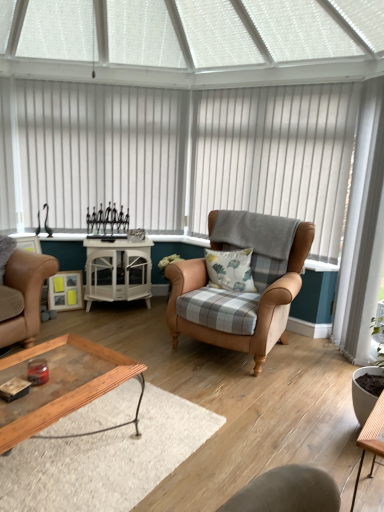
Image resolution: width=384 pixels, height=512 pixels. Describe the element at coordinates (276, 156) in the screenshot. I see `white vertical blinds at center, placed as the 1th blind when sorted from right to left` at that location.

From the picture: Measure the distance between point [379,398] and camera.

Point [379,398] and camera are 1.77 meters apart from each other.

How much space does white vertical blinds at upper center, the first blind when ordered from left to right, occupy horizontally?

It is 1.50 inches.

The height and width of the screenshot is (512, 384). What are the coordinates of `white vertical blinds at center, placed as the 1th blind when sorted from right to left` in the screenshot? It's located at (276, 156).

Is there a large distance between white vertical blinds at center, placed as the 1th blind when sorted from right to left, and leather armchair at center?

No, there isn't a large distance between white vertical blinds at center, placed as the 1th blind when sorted from right to left, and leather armchair at center.

In the scene shown: Is white vertical blinds at center, positioned as the 2th blind in left-to-right order, bigger or smaller than leather armchair at center?

In the image, white vertical blinds at center, positioned as the 2th blind in left-to-right order, appears to be smaller than leather armchair at center.

Does white vertical blinds at center, placed as the 1th blind when sorted from right to left, have a greater width compared to leather armchair at center?

In fact, white vertical blinds at center, placed as the 1th blind when sorted from right to left, might be narrower than leather armchair at center.

In the scene shown: Does white vertical blinds at center, positioned as the 2th blind in left-to-right order, contain leather armchair at center?

No, white vertical blinds at center, positioned as the 2th blind in left-to-right order, does not contain leather armchair at center.

Does wooden table at lower right, placed as the 2th table when sorted from back to front, touch wooden tray at lower center?

No.

Choose the correct answer: Is wooden table at lower right, the 1th table when ordered from right to left, inside wooden tray at lower center or outside it?

wooden table at lower right, the 1th table when ordered from right to left, exists outside the volume of wooden tray at lower center.

From the image's perspective, relative to wooden tray at lower center, is wooden table at lower right, which appears as the first table when ordered from the bottom, above or below?

Clearly, from the image's perspective, wooden table at lower right, which appears as the first table when ordered from the bottom, is below wooden tray at lower center.

Considering the positions of objects wooden table at lower right, the 1th table when ordered from right to left, and wooden tray at lower center in the image provided, who is more to the right, wooden table at lower right, the 1th table when ordered from right to left, or wooden tray at lower center?

wooden table at lower right, the 1th table when ordered from right to left.

Is white vertical blinds at upper center, the first blind when ordered from left to right, with wooden table at lower right, the second table in the top-to-bottom sequence?

white vertical blinds at upper center, the first blind when ordered from left to right, and wooden table at lower right, the second table in the top-to-bottom sequence, are not in contact.

Measure the distance between white vertical blinds at upper center, the first blind when ordered from left to right, and wooden table at lower right, the second table in the top-to-bottom sequence.

white vertical blinds at upper center, the first blind when ordered from left to right, is 10.50 feet from wooden table at lower right, the second table in the top-to-bottom sequence.

This screenshot has height=512, width=384. I want to click on the 2nd blind behind the wooden table at lower right, placed as the 2th table when sorted from back to front, so click(x=102, y=152).

Considering the sizes of white vertical blinds at upper center, marked as the 2th blind in a right-to-left arrangement, and wooden table at lower right, which appears as the first table when ordered from the bottom, in the image, is white vertical blinds at upper center, marked as the 2th blind in a right-to-left arrangement, bigger or smaller than wooden table at lower right, which appears as the first table when ordered from the bottom,?

Clearly, white vertical blinds at upper center, marked as the 2th blind in a right-to-left arrangement, is larger in size than wooden table at lower right, which appears as the first table when ordered from the bottom.

Is white vertical blinds at center, placed as the 1th blind when sorted from right to left, situated inside white vertical blinds at upper center, the first blind when ordered from left to right, or outside?

The correct answer is: outside.

Considering the sizes of white vertical blinds at center, positioned as the 2th blind in left-to-right order, and white vertical blinds at upper center, marked as the 2th blind in a right-to-left arrangement, in the image, is white vertical blinds at center, positioned as the 2th blind in left-to-right order, wider or thinner than white vertical blinds at upper center, marked as the 2th blind in a right-to-left arrangement,?

Considering their sizes, white vertical blinds at center, positioned as the 2th blind in left-to-right order, looks broader than white vertical blinds at upper center, marked as the 2th blind in a right-to-left arrangement.

Is white vertical blinds at center, placed as the 1th blind when sorted from right to left, facing towards white vertical blinds at upper center, the first blind when ordered from left to right?

No, white vertical blinds at center, placed as the 1th blind when sorted from right to left, is not aimed at white vertical blinds at upper center, the first blind when ordered from left to right.

Is the surface of white vertical blinds at center, placed as the 1th blind when sorted from right to left, in direct contact with white vertical blinds at upper center, the first blind when ordered from left to right?

No.

Is white glossy cabinet at center, the 2th table positioned from the front, surrounded by leather armchair at center?

No, white glossy cabinet at center, the 2th table positioned from the front, is not a part of leather armchair at center.

From the image's perspective, is leather armchair at center over white glossy cabinet at center, the 2th table positioned from the front?

No.

Measure the distance between leather armchair at center and white glossy cabinet at center, the 2th table in the bottom-to-top sequence.

leather armchair at center is 37.58 inches away from white glossy cabinet at center, the 2th table in the bottom-to-top sequence.

Which is more to the left, leather armchair at center or white glossy cabinet at center, which is counted as the first table, starting from the top?

Positioned to the left is white glossy cabinet at center, which is counted as the first table, starting from the top.

Is fluffy cotton pillow at center far away from wooden tray at lower center?

That's right, there is a large distance between fluffy cotton pillow at center and wooden tray at lower center.

Could wooden tray at lower center be considered to be inside fluffy cotton pillow at center?

No, wooden tray at lower center is not inside fluffy cotton pillow at center.

Considering the points (234, 281) and (29, 352), which point is behind, point (234, 281) or point (29, 352)?

Point (234, 281)

Is fluffy cotton pillow at center wider or thinner than wooden tray at lower center?

In the image, fluffy cotton pillow at center appears to be more narrow than wooden tray at lower center.

Are wooden table at lower right, the 1th table positioned from the front, and white vertical blinds at center, positioned as the 2th blind in left-to-right order, far apart?

Yes, wooden table at lower right, the 1th table positioned from the front, and white vertical blinds at center, positioned as the 2th blind in left-to-right order, are quite far apart.

Is wooden table at lower right, placed as the 2th table when sorted from back to front, positioned beyond the bounds of white vertical blinds at center, positioned as the 2th blind in left-to-right order?

Absolutely, wooden table at lower right, placed as the 2th table when sorted from back to front, is external to white vertical blinds at center, positioned as the 2th blind in left-to-right order.

From a real-world perspective, between wooden table at lower right, the 1th table positioned from the front, and white vertical blinds at center, placed as the 1th blind when sorted from right to left, who is vertically lower?

wooden table at lower right, the 1th table positioned from the front.

Does point (368, 426) come in front of point (352, 134)?

Yes, it is.

Find the location of a particular element. This screenshot has width=384, height=512. chair in front of the white vertical blinds at center, placed as the 1th blind when sorted from right to left is located at coordinates (243, 293).

Where is `coffee table on the left of wooden table at lower right, the 1th table positioned from the front`? This screenshot has height=512, width=384. coffee table on the left of wooden table at lower right, the 1th table positioned from the front is located at coordinates (60, 384).

Estimate the real-world distances between objects in this image. Which object is closer to fluffy cotton pillow at center, white glossy cabinet at center, marked as the first table in a left-to-right arrangement, or leather armchair at center?

leather armchair at center.

Which object lies nearer to the anchor point white glossy cabinet at center, marked as the first table in a left-to-right arrangement, wooden tray at lower center or white vertical blinds at center, placed as the 1th blind when sorted from right to left?

white vertical blinds at center, placed as the 1th blind when sorted from right to left.

Looking at the image, which one is located closer to white vertical blinds at center, placed as the 1th blind when sorted from right to left, wooden tray at lower center or wooden table at lower right, the 1th table when ordered from right to left?

Among the two, wooden tray at lower center is located nearer to white vertical blinds at center, placed as the 1th blind when sorted from right to left.

From the image, which object appears to be farther from wooden table at lower right, the second table in the top-to-bottom sequence, white glossy cabinet at center, the 2th table positioned from the front, or white vertical blinds at upper center, the first blind when ordered from left to right?

Among the two, white vertical blinds at upper center, the first blind when ordered from left to right, is located further to wooden table at lower right, the second table in the top-to-bottom sequence.

Considering their positions, is wooden tray at lower center positioned closer to fluffy cotton pillow at center than white vertical blinds at center, positioned as the 2th blind in left-to-right order?

white vertical blinds at center, positioned as the 2th blind in left-to-right order, is closer to fluffy cotton pillow at center.

Estimate the real-world distances between objects in this image. Which object is further from fluffy cotton pillow at center, white vertical blinds at center, placed as the 1th blind when sorted from right to left, or wooden tray at lower center?

The object further to fluffy cotton pillow at center is wooden tray at lower center.

Looking at the image, which one is located further to white vertical blinds at center, placed as the 1th blind when sorted from right to left, fluffy cotton pillow at center or white vertical blinds at upper center, the first blind when ordered from left to right?

Based on the image, fluffy cotton pillow at center appears to be further to white vertical blinds at center, placed as the 1th blind when sorted from right to left.

Looking at this image, when comparing their distances from fluffy cotton pillow at center, does white vertical blinds at upper center, the first blind when ordered from left to right, or white vertical blinds at center, placed as the 1th blind when sorted from right to left, seem further?

white vertical blinds at upper center, the first blind when ordered from left to right, is further to fluffy cotton pillow at center.

This screenshot has width=384, height=512. I want to click on pillow between white glossy cabinet at center, which is counted as the first table, starting from the top, and white vertical blinds at center, placed as the 1th blind when sorted from right to left, in the horizontal direction, so tap(230, 269).

Locate an element on the screen. Image resolution: width=384 pixels, height=512 pixels. blind positioned between wooden tray at lower center and white glossy cabinet at center, the 2th table positioned from the front, from near to far is located at coordinates 276,156.

Where is `pillow between white vertical blinds at upper center, marked as the 2th blind in a right-to-left arrangement, and white vertical blinds at center, placed as the 1th blind when sorted from right to left, in the horizontal direction`? The height and width of the screenshot is (512, 384). pillow between white vertical blinds at upper center, marked as the 2th blind in a right-to-left arrangement, and white vertical blinds at center, placed as the 1th blind when sorted from right to left, in the horizontal direction is located at coordinates (230, 269).

You are a GUI agent. You are given a task and a screenshot of the screen. Output one action in this format:
    pyautogui.click(x=<x>, y=<y>)
    Task: Click on the chair between wooden tray at lower center and wooden table at lower right, placed as the 2th table when sorted from back to front, from left to right
    The width and height of the screenshot is (384, 512).
    Given the screenshot: What is the action you would take?
    pyautogui.click(x=243, y=293)